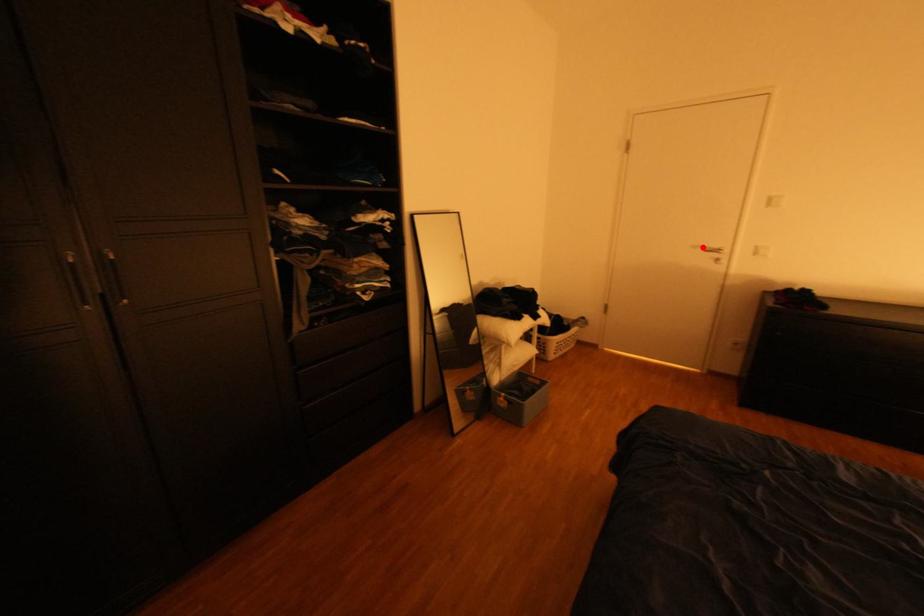
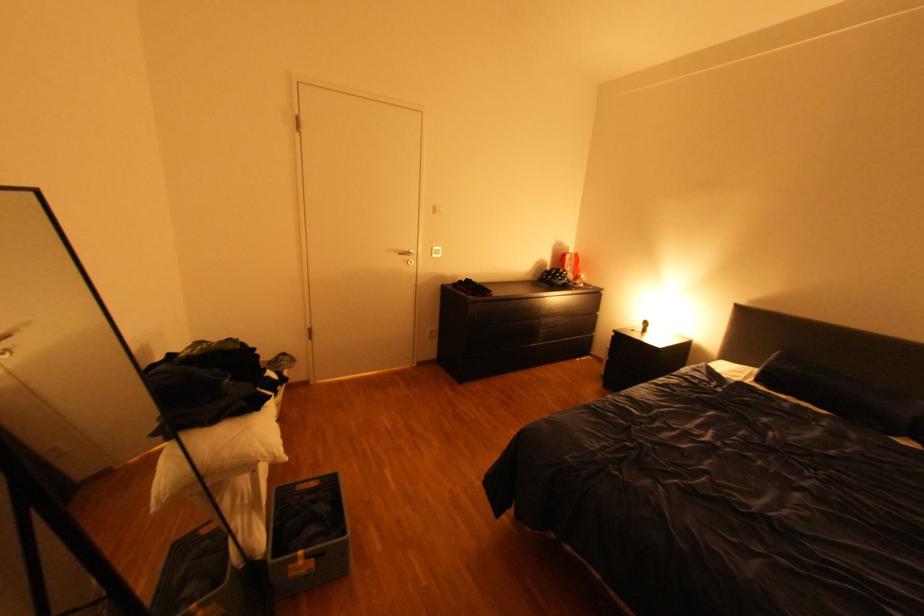
Find the pixel in the second image that matches the highlighted location in the first image.

(399, 249)